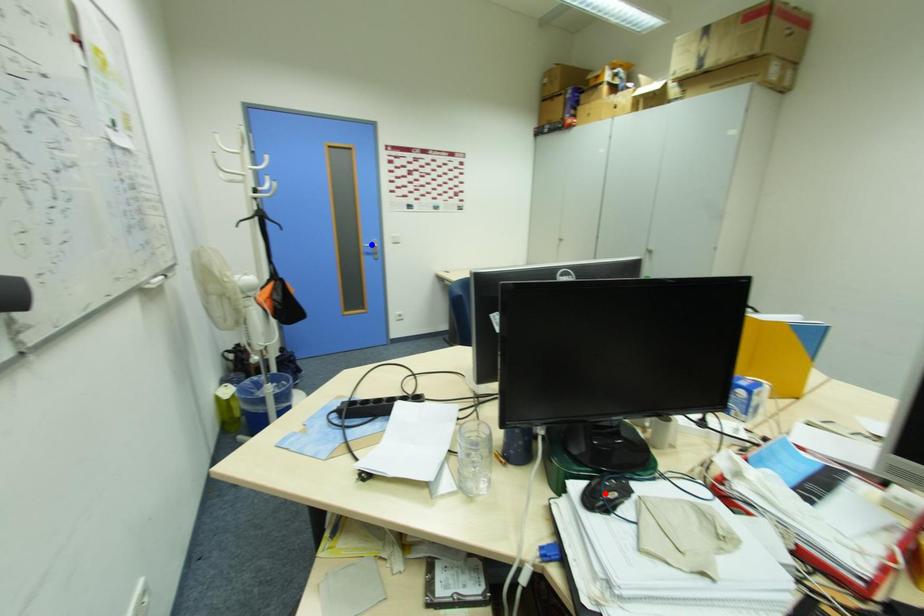
Question: Two points are marked on the image. Which point is closer to the camera?

Choices:
 (A) Blue point is closer.
 (B) Red point is closer.

Answer: (B)